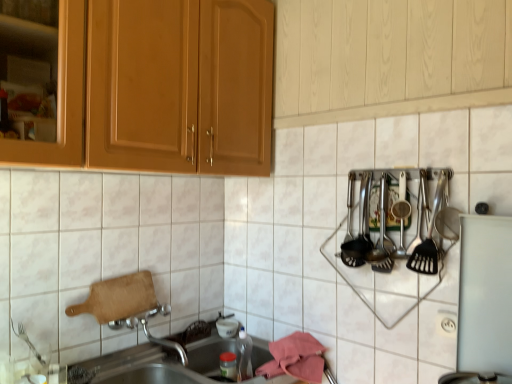
The width and height of the screenshot is (512, 384). I want to click on vacant area on top of white glossy tile at upper center (from a real-world perspective), so click(360, 121).